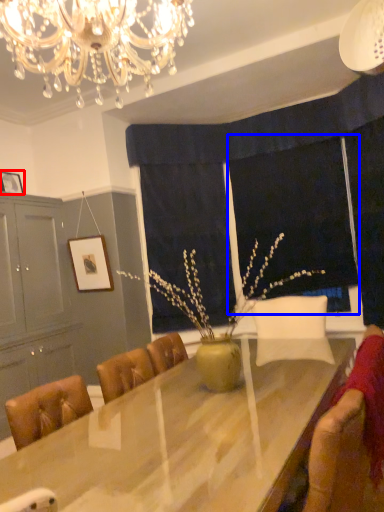
Question: Which object is closer to the camera taking this photo, picture frame (highlighted by a red box) or window screen (highlighted by a blue box)?

Choices:
 (A) picture frame
 (B) window screen

Answer: (A)